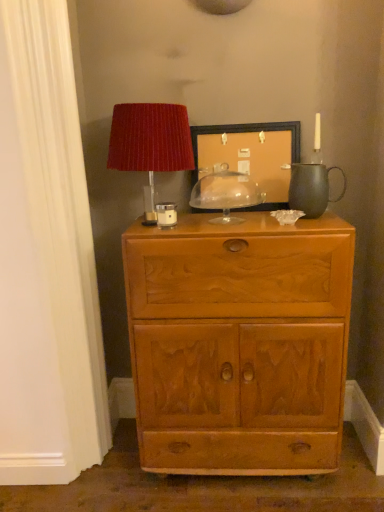
Question: Considering the positions of light brown wood chest of drawers at center and wooden picture frame at center in the image, is light brown wood chest of drawers at center bigger or smaller than wooden picture frame at center?

Choices:
 (A) big
 (B) small

Answer: (A)

Question: From the image's perspective, is light brown wood chest of drawers at center positioned above or below wooden picture frame at center?

Choices:
 (A) below
 (B) above

Answer: (A)

Question: Which of these objects is positioned farthest from the matte white candle holder at upper center, the 2th candle holder from the right?

Choices:
 (A) light brown wood chest of drawers at center
 (B) clear glass dome at center, which appears as the 2th candle holder when viewed from the front
 (C) matte red lampshade at upper left
 (D) matte black teapot at right
 (E) wooden picture frame at center

Answer: (A)

Question: Estimate the real-world distances between objects in this image. Which object is farther from the matte white candle holder at upper center, the first candle holder in the front-to-back sequence?

Choices:
 (A) matte red lampshade at upper left
 (B) wooden picture frame at center
 (C) clear glass dome at center, which appears as the 2th candle holder when viewed from the front
 (D) light brown wood chest of drawers at center
 (E) matte black teapot at right

Answer: (D)